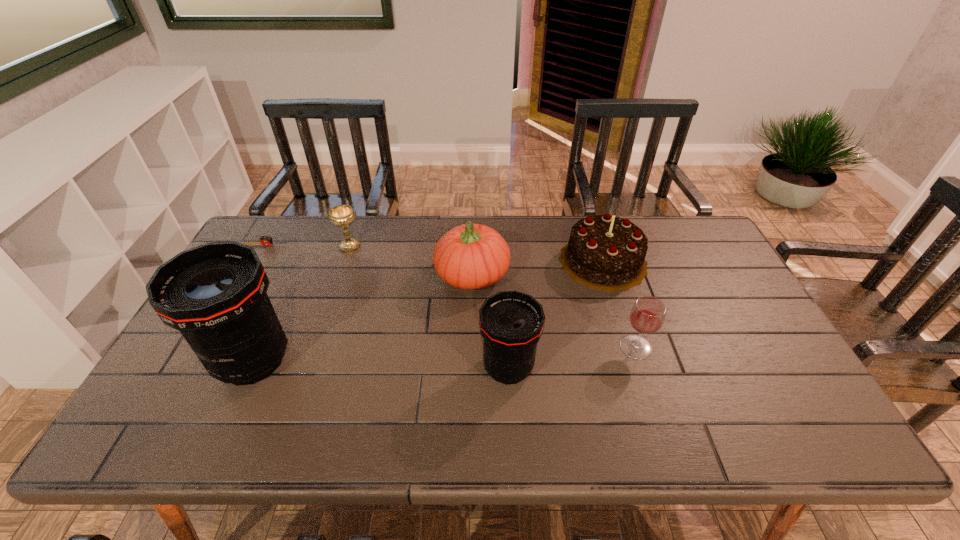
The image size is (960, 540). What are the coordinates of `free space between the wineglass and the right telephoto lens` in the screenshot? It's located at (572, 357).

Locate an element on the screen. The height and width of the screenshot is (540, 960). vacant region between the wineglass and the taller telephoto lens is located at coordinates [x=444, y=354].

Find the location of `empty space between the birthday cake and the right telephoto lens`. empty space between the birthday cake and the right telephoto lens is located at coordinates (556, 315).

The image size is (960, 540). I want to click on unoccupied position between the right telephoto lens and the tallest object, so click(x=381, y=364).

Find the location of a particular element. vacant region between the birthday cake and the shorter telephoto lens is located at coordinates (556, 315).

Where is `vacant space that is in between the pumpkin and the wineglass`? This screenshot has width=960, height=540. vacant space that is in between the pumpkin and the wineglass is located at coordinates (554, 311).

The height and width of the screenshot is (540, 960). Identify the location of vacant point located between the chalice and the tallest object. (301, 303).

This screenshot has height=540, width=960. What are the coordinates of `object that can be found as the fifth closest to the shorter telephoto lens` in the screenshot? It's located at (342, 216).

Locate an element on the screen. The width and height of the screenshot is (960, 540). the sixth closest object to the chalice is located at coordinates (647, 316).

The height and width of the screenshot is (540, 960). In order to click on vacant space that satisfies the following two spatial constraints: 1. on the front side of the pumpkin; 2. on the left side of the shorter telephoto lens in this screenshot , I will do `click(470, 368)`.